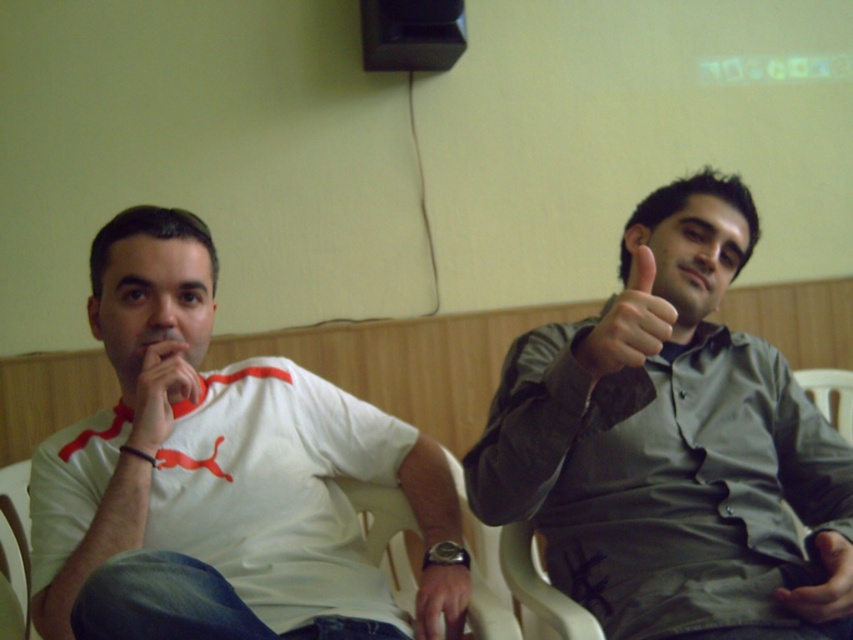
You are an observer in the room. You see the gray matte shirt at upper right and the matte white hand at center. Which object is positioned more to the right side of the image?

The gray matte shirt at upper right is positioned to the right of the matte white hand at center, so the gray matte shirt at upper right is more to the right side of the image.

You are an AI analyzing the image. The image has a coordinate system where the bottom left corner is the origin. The coordinates are normalized between 0 and 1. Where is the matte skin hand at upper right located in the image? Please provide the coordinates as a point in the format of a tuple with two decimal places.

The matte skin hand at upper right is located at point (630, 323).